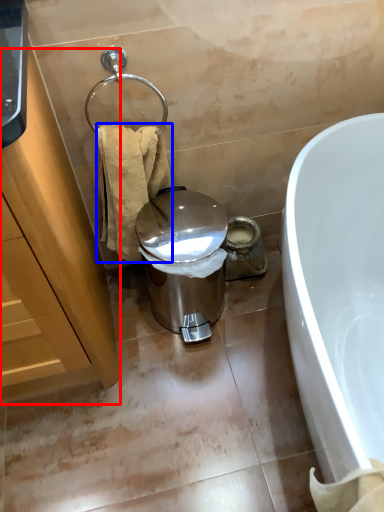
Question: Which point is further to the camera, cabinetry (highlighted by a red box) or towel/napkin (highlighted by a blue box)?

Choices:
 (A) cabinetry
 (B) towel/napkin

Answer: (B)